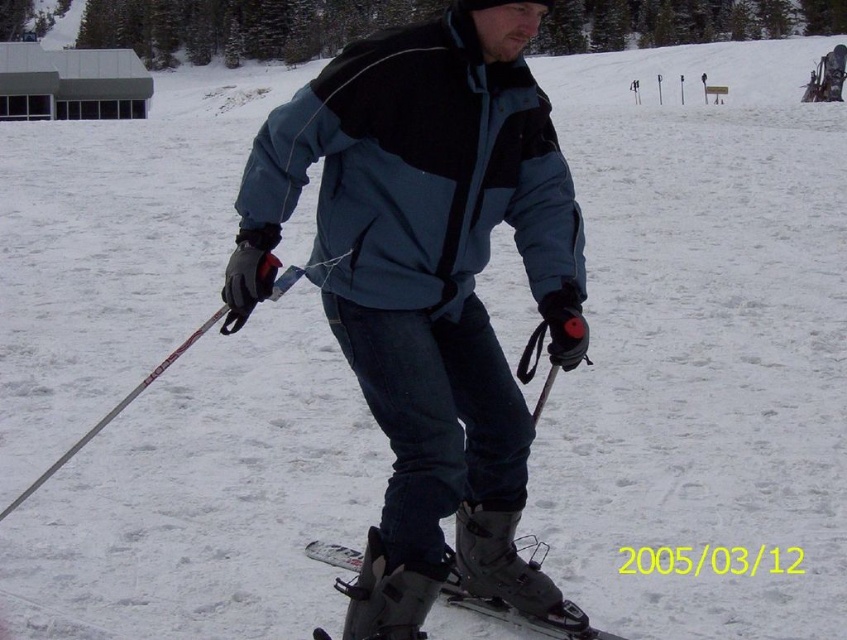
Question: Is matte black ski at center behind white plastic ski pole at left?

Choices:
 (A) yes
 (B) no

Answer: (A)

Question: From the image, what is the correct spatial relationship of matte black ski at center in relation to white plastic ski pole at left?

Choices:
 (A) above
 (B) below

Answer: (B)

Question: Which point is farther to the camera?

Choices:
 (A) (480, 70)
 (B) (533, 552)
 (C) (165, 362)

Answer: (B)

Question: Which point is farther from the camera taking this photo?

Choices:
 (A) (x=154, y=371)
 (B) (x=576, y=637)
 (C) (x=490, y=163)

Answer: (A)

Question: Which is farther from the white plastic ski pole at left?

Choices:
 (A) matte blue ski jacket at center
 (B) matte black ski at center

Answer: (B)

Question: Can you confirm if matte black ski at center is positioned to the left of white plastic ski pole at left?

Choices:
 (A) no
 (B) yes

Answer: (A)